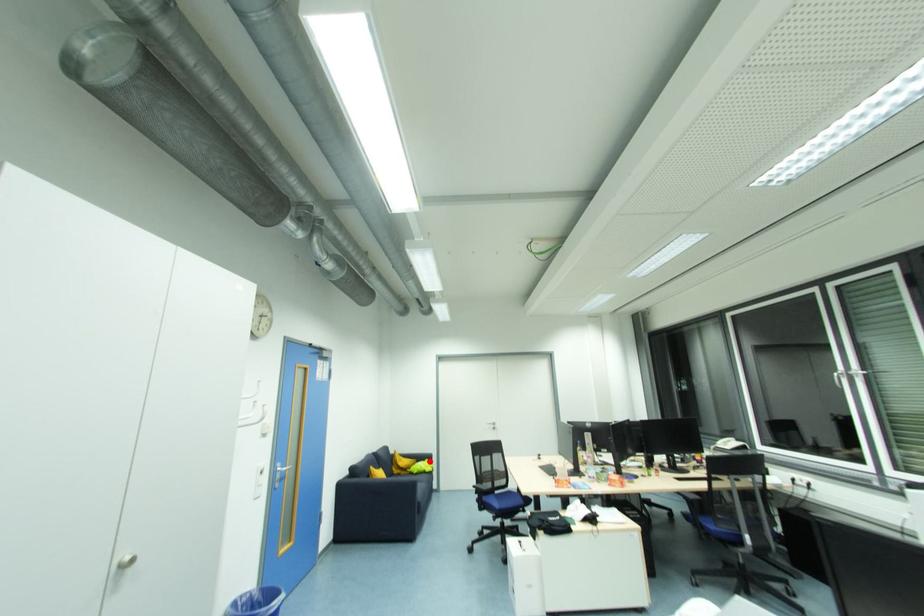
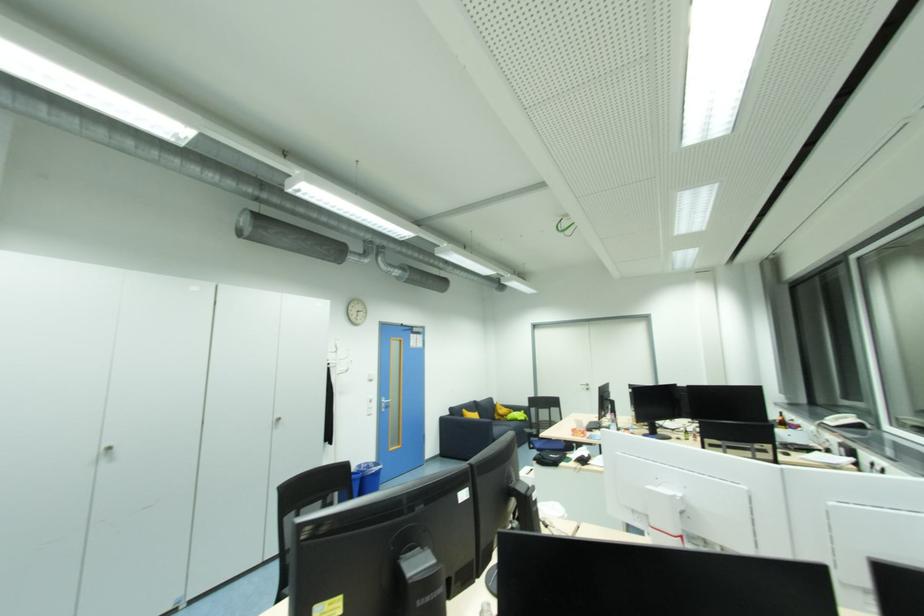
Locate, in the second image, the point that corresponds to the highlighted location in the first image.

(526, 413)